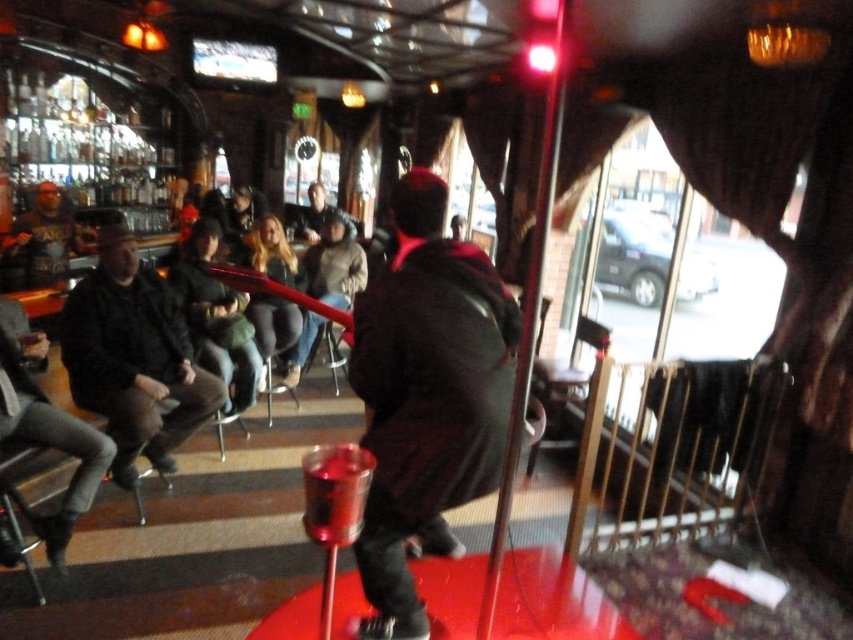
You are a photographer setting up a camera to capture the scene. You need to adjust the focus so that both the dark brown leather jacket at left and the matte black jacket at left are in clear view. Considering their heights, which jacket should you focus on first to ensure both are in focus?

Answer: The dark brown leather jacket at left is taller than the matte black jacket at left. To ensure both are in focus, you should focus on the taller dark brown leather jacket at left first, as it requires adjusting the focus to a greater distance, which will naturally include the shorter matte black jacket at left within the depth of field.

In the scene shown: You are a photographer at the event and need to position yourself to capture both the dark brown leather jacket at center and the matte black jacket at left in the same frame. Based on their positions, which jacket should you place on the left side of your photo?

You should place the matte black jacket at left on the left side of your photo since the dark brown leather jacket at center is to the right of it.

You are a photographer trying to capture a candid shot of the crowd in the bar. You notice two dark brown leather jackets in the scene. Which jacket is narrower in width when comparing the dark brown leather jacket at center and the dark brown leather jacket at left?

The dark brown leather jacket at center is narrower in width compared to the dark brown leather jacket at left.